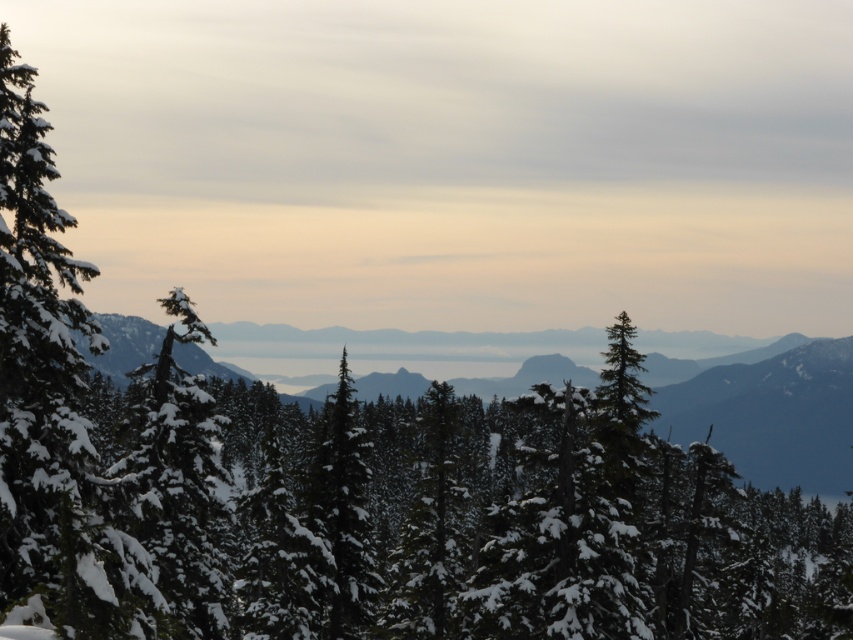
You are standing at point (178, 483) in the winter landscape. What do you see immediately around you?

You see a snow covered evergreen at left immediately around you.